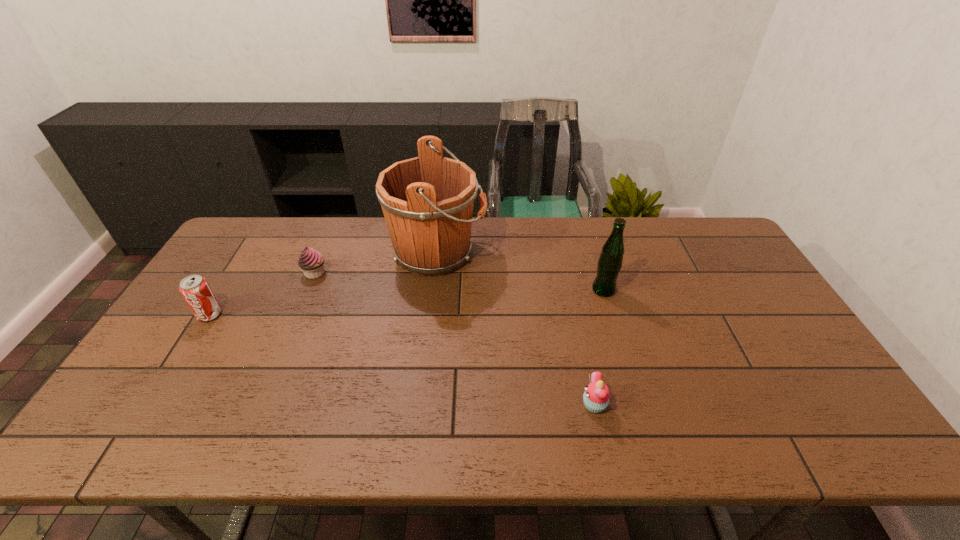
Find the location of a particular element. Image resolution: width=960 pixels, height=540 pixels. free spot located with the handle on the side of the tallest object is located at coordinates (579, 253).

Identify the location of vacant space located 0.090m on the right of the beer bottle. (644, 290).

At what (x,y) coordinates should I click in order to perform the action: click on vacant space located on the back of the fourth farthest object. Please return your answer as a coordinate pair (x, y). Looking at the image, I should click on (250, 251).

Identify the location of vacant region located on the right of the farther cupcake. (450, 273).

Locate an element on the screen. vacant region located on the face of the right cupcake is located at coordinates (506, 405).

Locate an element on the screen. The image size is (960, 540). blank space located on the face of the right cupcake is located at coordinates (497, 405).

In order to click on vacant space situated 0.080m on the face of the right cupcake in this screenshot , I will do `click(548, 405)`.

Locate an element on the screen. This screenshot has width=960, height=540. object that is at the far edge is located at coordinates (427, 201).

At what (x,y) coordinates should I click in order to perform the action: click on object that is at the near edge. Please return your answer as a coordinate pair (x, y). The height and width of the screenshot is (540, 960). Looking at the image, I should click on (596, 397).

Where is `object at the left edge`? The height and width of the screenshot is (540, 960). object at the left edge is located at coordinates (195, 289).